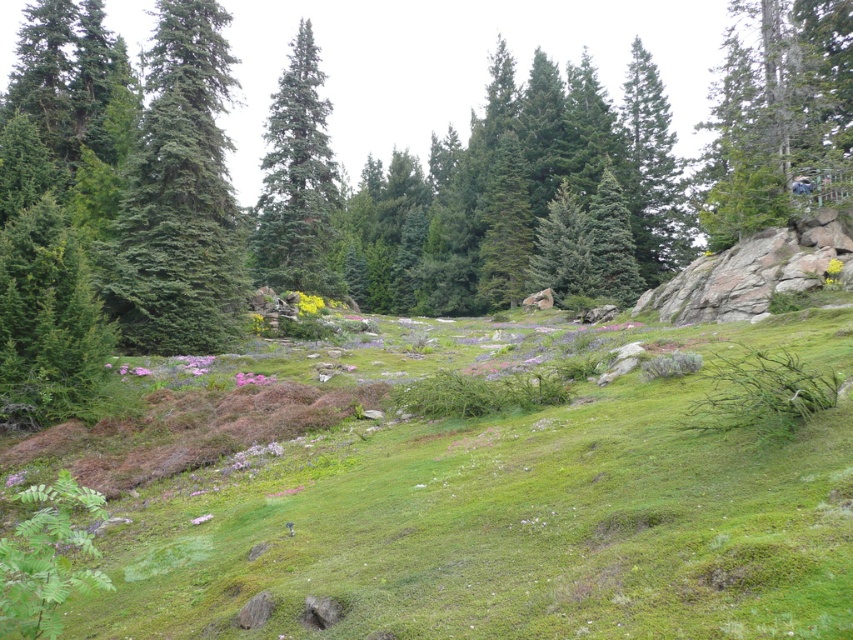
Question: Which point is farther from the camera taking this photo?

Choices:
 (A) (155, 333)
 (B) (383, 435)
 (C) (311, 285)

Answer: (C)

Question: Among these objects, which one is farthest from the camera?

Choices:
 (A) green needle-like at left
 (B) green textured pine tree at center
 (C) green grassy at lower left

Answer: (B)

Question: Is green needle-like at left wider than green textured pine tree at center?

Choices:
 (A) no
 (B) yes

Answer: (A)

Question: Which of the following is the farthest from the observer?

Choices:
 (A) (189, 225)
 (B) (302, 131)
 (C) (730, 451)

Answer: (B)

Question: Can you confirm if green needle-like at left is thinner than green textured pine tree at center?

Choices:
 (A) yes
 (B) no

Answer: (A)

Question: Is green needle-like at left above green textured pine tree at center?

Choices:
 (A) no
 (B) yes

Answer: (A)